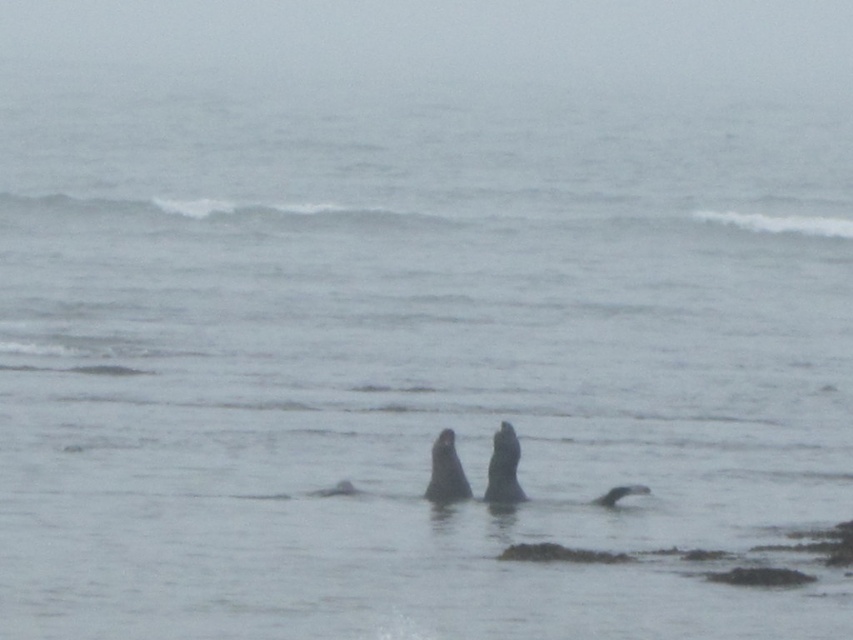
Does point (515, 435) come farther from viewer compared to point (637, 484)?

No, it is not.

Is gray matte seal at center smaller than dark gray fur seal at lower center?

No.

I want to click on gray matte seal at center, so click(x=503, y=468).

Does point (445, 445) come closer to viewer compared to point (643, 493)?

That is True.

Is point (450, 433) positioned behind point (621, 493)?

No.

Locate an element on the screen. The height and width of the screenshot is (640, 853). dark gray fur seal at center is located at coordinates (445, 472).

Is gray matte seal at center smaller than dark gray fur seal at center?

Indeed, gray matte seal at center has a smaller size compared to dark gray fur seal at center.

Can you confirm if gray matte seal at center is thinner than dark gray fur seal at center?

Yes.

Does point (497, 502) come farther from viewer compared to point (450, 497)?

Yes, it is behind point (450, 497).

The width and height of the screenshot is (853, 640). In order to click on gray matte seal at center in this screenshot , I will do `click(503, 468)`.